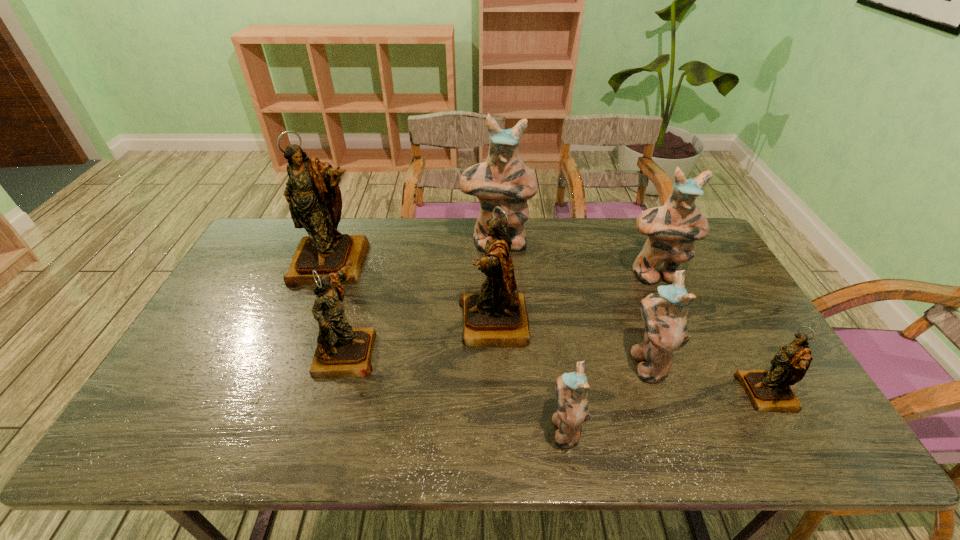
The width and height of the screenshot is (960, 540). In order to click on empty location between the third biggest pink figurine and the farthest pink figurine in this screenshot , I will do `click(572, 302)`.

The height and width of the screenshot is (540, 960). In order to click on vacant region between the smallest gold figurine and the second nearest pink figurine in this screenshot , I will do `click(707, 377)`.

This screenshot has width=960, height=540. Identify the location of free point between the second nearest pink figurine and the smallest gold figurine. (707, 377).

This screenshot has height=540, width=960. Identify the location of empty space that is in between the smallest gold figurine and the second nearest pink figurine. (707, 377).

The height and width of the screenshot is (540, 960). I want to click on vacant area that lies between the second gold figurine from right to left and the second biggest pink figurine, so click(575, 299).

Find the location of a particular element. free spot between the third gold figurine from left to right and the third biggest pink figurine is located at coordinates (570, 342).

At what (x,y) coordinates should I click in order to perform the action: click on object that is the second closest to the third smallest gold figurine. Please return your answer as a coordinate pair (x, y). The height and width of the screenshot is (540, 960). Looking at the image, I should click on (504, 180).

Locate an element on the screen. The image size is (960, 540). the third closest object to the smallest gold figurine is located at coordinates (571, 388).

Point out which figurine is positioned as the seventh nearest to the biggest gold figurine. Please provide its 2D coordinates. Your answer should be formatted as a tuple, i.e. [(x, y)], where the tuple contains the x and y coordinates of a point satisfying the conditions above.

[(769, 390)]

Where is `the fourth closest figurine to the farthest gold figurine`? This screenshot has height=540, width=960. the fourth closest figurine to the farthest gold figurine is located at coordinates (571, 388).